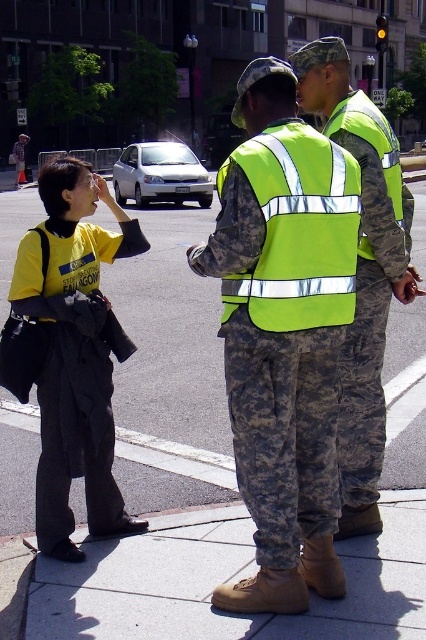
What is the coordinate of the gray concrete pavement at center?

The gray concrete pavement at center is located at coordinate point [169,372].

You are a delivery person trying to avoid stepping on the gray concrete pavement at center. You need to place your foot on the neon yellow reflective vest at center. Is this possible?

The gray concrete pavement at center is above the neon yellow reflective vest at center, so placing your foot on the neon yellow reflective vest at center would require stepping on the gray concrete pavement at center first.